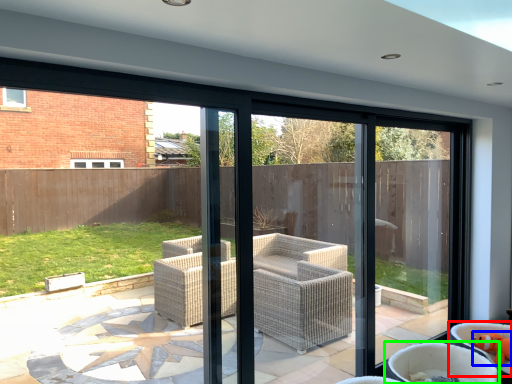
Question: Which object is the closest to the chair (highlighted by a red box)? Choose among these: toy (highlighted by a blue box) or chair (highlighted by a green box).

Choices:
 (A) toy
 (B) chair

Answer: (A)